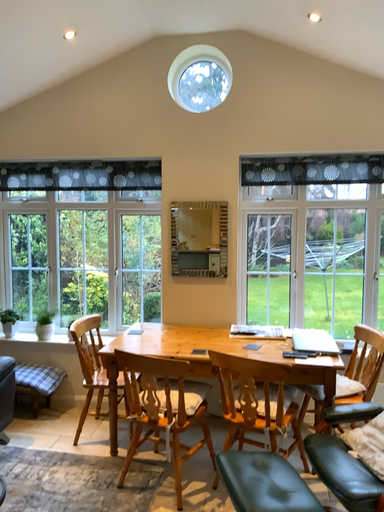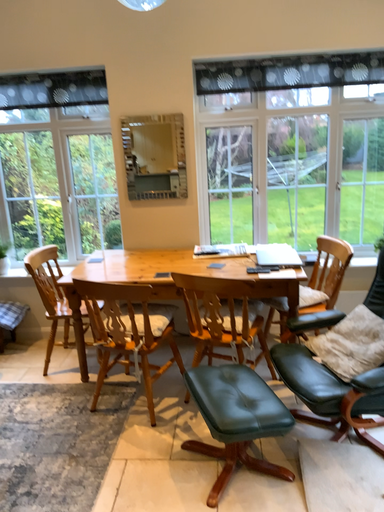
Question: Which way did the camera rotate in the video?

Choices:
 (A) rotated upward
 (B) rotated downward

Answer: (B)